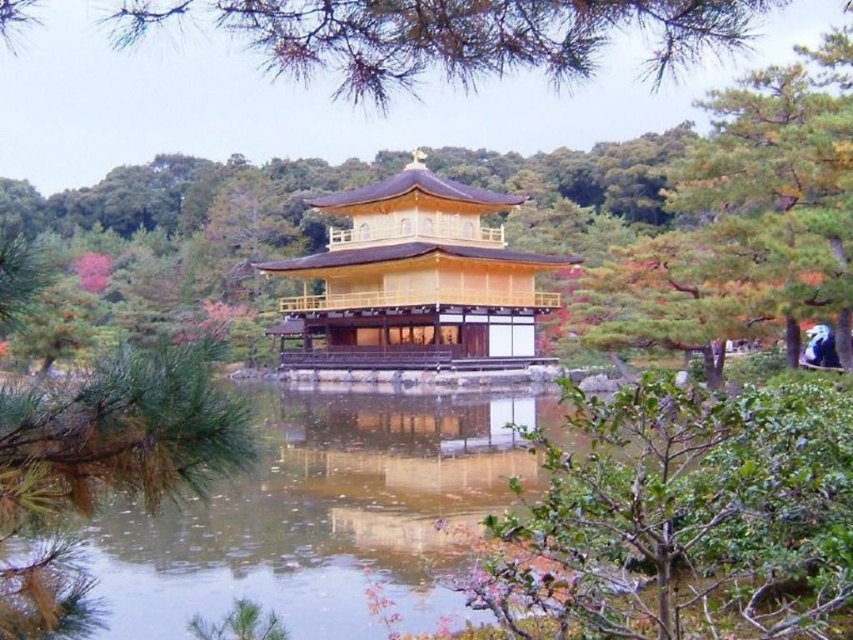
Consider the image. You are standing in front of the Golden Pavilion and want to take a photo of the golden polished wood temple at center and its reflection in the clear water at center. Which object should you focus on first to capture both the temple and its reflection clearly?

You should focus on the golden polished wood temple at center first because the clear water at center is in front of it, so capturing the temple in focus will naturally include the reflection in the water.

You are a visitor at the Golden Pavilion and want to take a photo that captures both the clear water at center and the golden polished wood temple at center. Which object should you focus on first to ensure both are in the frame?

The clear water at center is thinner than the golden polished wood temple at center, so you should focus on the golden polished wood temple at center first to ensure both fit in the frame.